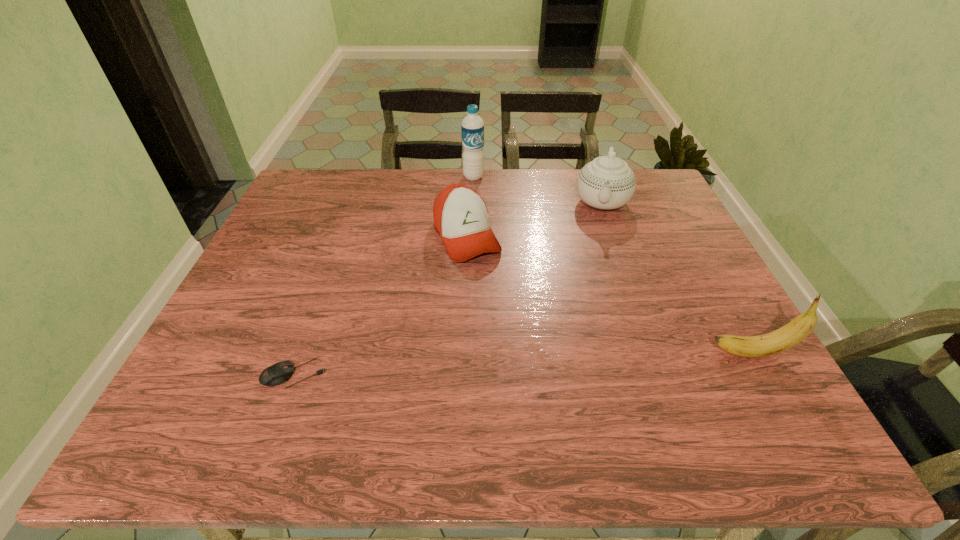
The image size is (960, 540). What are the coordinates of `the leftmost object` in the screenshot? It's located at (279, 373).

The image size is (960, 540). Find the location of `mouse`. mouse is located at coordinates (279, 373).

The image size is (960, 540). What are the coordinates of `banana` in the screenshot? It's located at click(x=784, y=338).

Where is `the second shortest object`? Image resolution: width=960 pixels, height=540 pixels. the second shortest object is located at coordinates (460, 215).

At what (x,y) coordinates should I click in order to perform the action: click on the tallest object. Please return your answer as a coordinate pair (x, y). Looking at the image, I should click on (472, 127).

This screenshot has height=540, width=960. I want to click on chinaware, so click(607, 182).

You are a GUI agent. You are given a task and a screenshot of the screen. Output one action in this format:
    pyautogui.click(x=<x>, y=<y>)
    Task: Click on the vacant space located 0.060m on the right of the shortest object
    The image size is (960, 540).
    Given the screenshot: What is the action you would take?
    pyautogui.click(x=354, y=374)

Locate an element on the screen. free region located at the start of the peel on the banana is located at coordinates (677, 353).

Find the location of a particular element. vacant space located at the start of the peel on the banana is located at coordinates (639, 353).

Where is `free location located at the start of the peel on the banana`? This screenshot has width=960, height=540. free location located at the start of the peel on the banana is located at coordinates (597, 353).